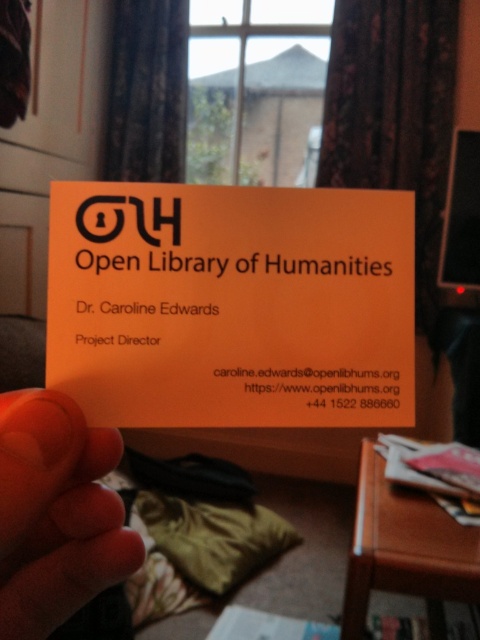
Question: Which point is farther from the camera taking this photo?

Choices:
 (A) (0, 632)
 (B) (80, 301)

Answer: (B)

Question: Is orange matte business card at center in front of flesh-toned skin at lower left?

Choices:
 (A) no
 (B) yes

Answer: (A)

Question: Does orange matte business card at center lie in front of flesh-toned skin at lower left?

Choices:
 (A) yes
 (B) no

Answer: (B)

Question: Does orange matte business card at center have a greater width compared to flesh-toned skin at lower left?

Choices:
 (A) no
 (B) yes

Answer: (B)